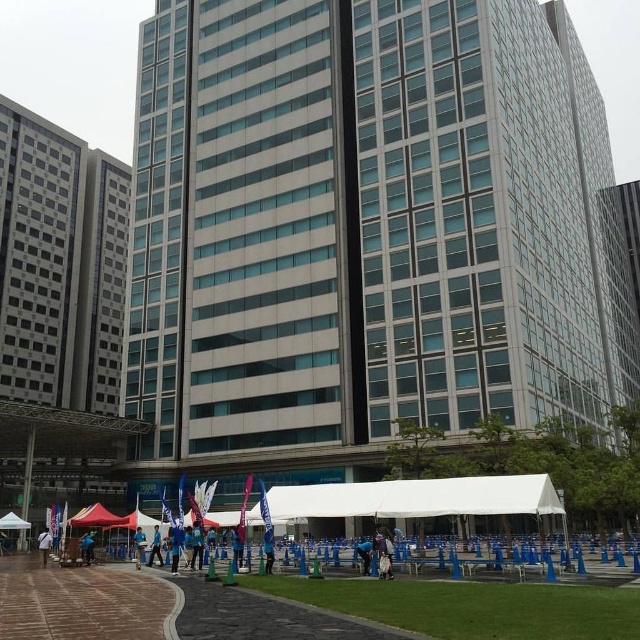
Between point (51, 547) and point (138, 541), which one is positioned behind?

The point (51, 547) is more distant.

Is white fabric bag at lower center to the left of blue fabric at center from the viewer's perspective?

Correct, you'll find white fabric bag at lower center to the left of blue fabric at center.

Does point (51, 541) come behind point (134, 552)?

No, it is in front of (134, 552).

Locate an element on the screen. The width and height of the screenshot is (640, 640). white fabric bag at lower center is located at coordinates (44, 545).

The image size is (640, 640). Describe the element at coordinates (44, 545) in the screenshot. I see `white fabric bag at lower center` at that location.

Which is more to the left, white fabric bag at lower center or blue fabric person at center?

From the viewer's perspective, white fabric bag at lower center appears more on the left side.

Which is in front, point (42, 545) or point (148, 556)?

Point (148, 556) is more forward.

Find the location of `white fabric bag at lower center`. white fabric bag at lower center is located at coordinates pos(44,545).

Is point (344, 486) in front of point (83, 561)?

Yes, point (344, 486) is closer to viewer.

Is white fabric canopy at center bigger than blue fabric tent at center?

Yes.

Is point (385, 481) closer to viewer compared to point (84, 556)?

Yes, point (385, 481) is in front of point (84, 556).

Identify the location of white fabric canopy at center. coord(417,497).